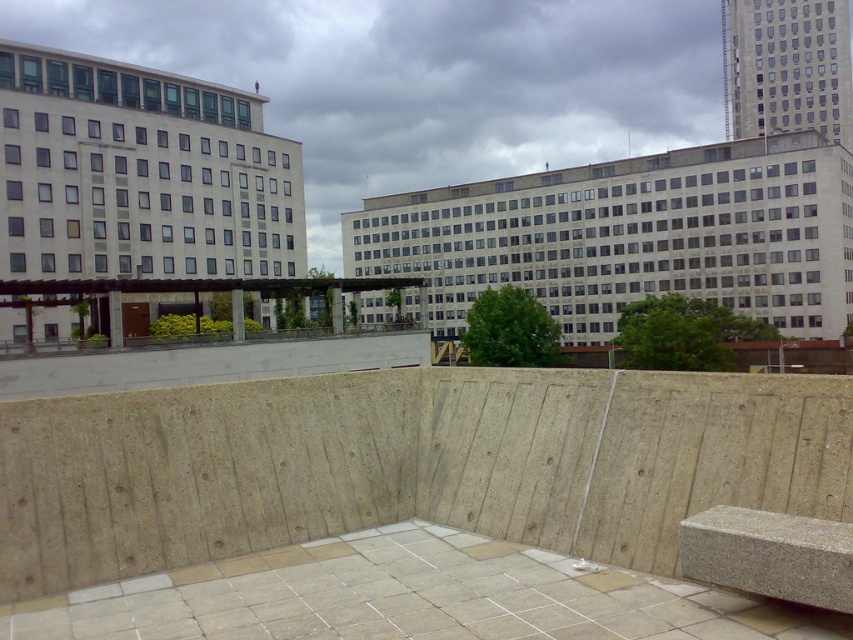
You are standing in the urban scene and want to sit on either the gray concrete bench at lower right or the granite bench at lower right. Which bench is closer to you?

The gray concrete bench at lower right is closer to you since the granite bench at lower right is behind it.

You are standing at the center of the image. Which direction should you move to reach the gray concrete bench at lower right?

You should move towards the lower right direction to reach the gray concrete bench at lower right since it is located at point (410, 596).

Based on the photo, you are a delivery person trying to place a box on a surface in the urban scene. You have two options available, the gray concrete bench at lower right and the concrete ledge at center. Which surface would be more stable for placing a heavy box?

The concrete ledge at center is taller than the gray concrete bench at lower right, so it would provide a more stable surface for placing a heavy box.